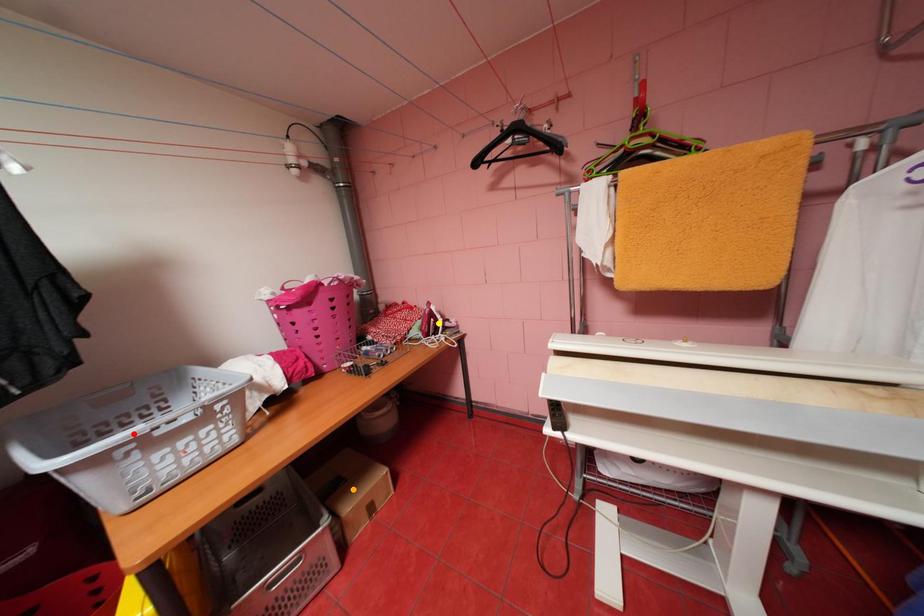
Order these from farthest to nearest:
- red point
- orange point
- yellow point

yellow point → orange point → red point